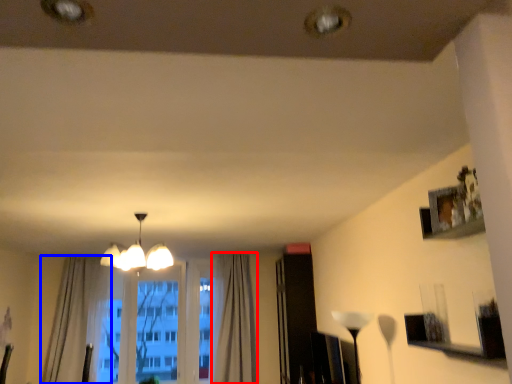
Question: Which point is closer to the camera, curtain (highlighted by a red box) or curtain (highlighted by a blue box)?

Choices:
 (A) curtain
 (B) curtain

Answer: (B)